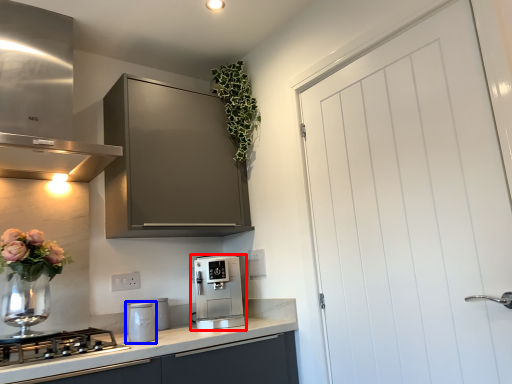
Question: Which of the following is the closest to the observer, kitchen appliance (highlighted by a red box) or kitchen appliance (highlighted by a blue box)?

Choices:
 (A) kitchen appliance
 (B) kitchen appliance

Answer: (B)